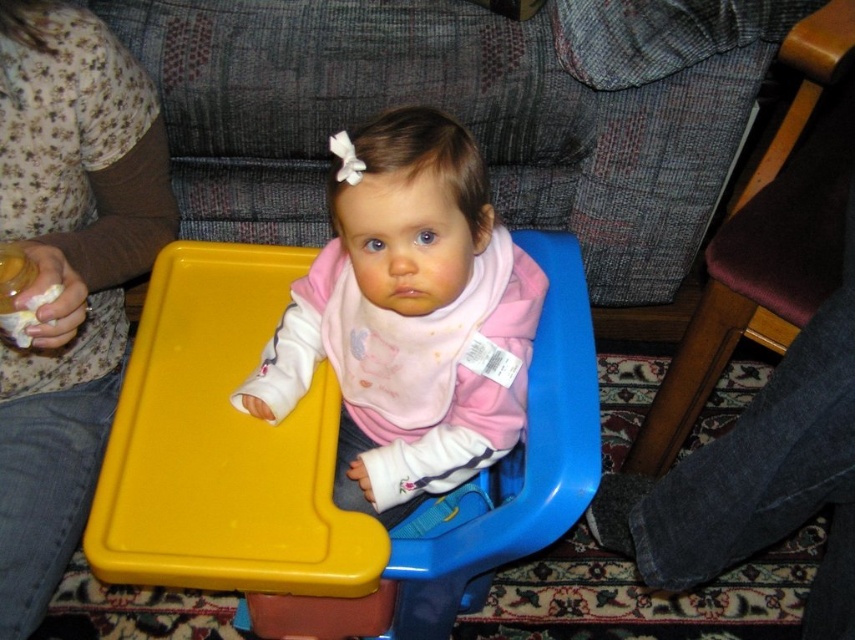
Question: Which of the following is the farthest from the observer?

Choices:
 (A) click(345, 468)
 (B) click(789, 54)

Answer: (B)

Question: Where is pink matte bib at center located in relation to wooden chair at right in the image?

Choices:
 (A) right
 (B) left

Answer: (B)

Question: Considering the relative positions of pink matte bib at center and wooden chair at right in the image provided, where is pink matte bib at center located with respect to wooden chair at right?

Choices:
 (A) right
 (B) left

Answer: (B)

Question: Can you confirm if pink matte bib at center is positioned below wooden chair at right?

Choices:
 (A) no
 (B) yes

Answer: (B)

Question: Which object is farther from the camera taking this photo?

Choices:
 (A) wooden chair at right
 (B) pink matte bib at center

Answer: (A)